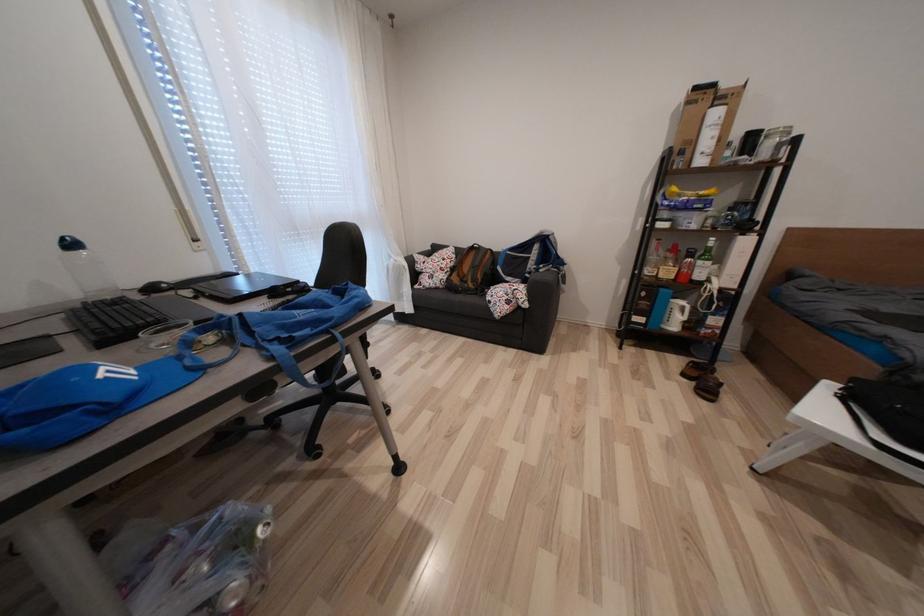
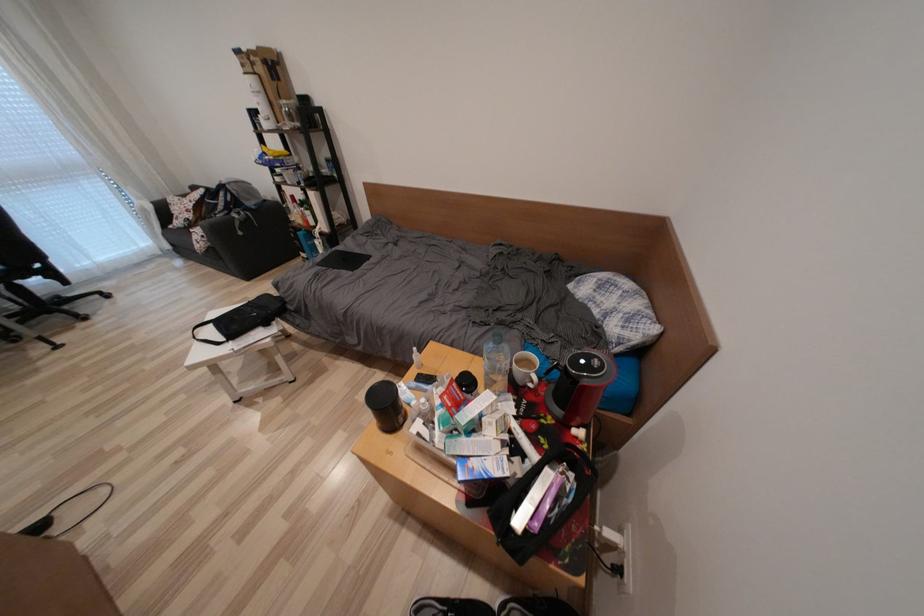
Question: What movement of the cameraman would produce the second image?

Choices:
 (A) Left
 (B) Right
 (C) Forward
 (D) Backward

Answer: (B)